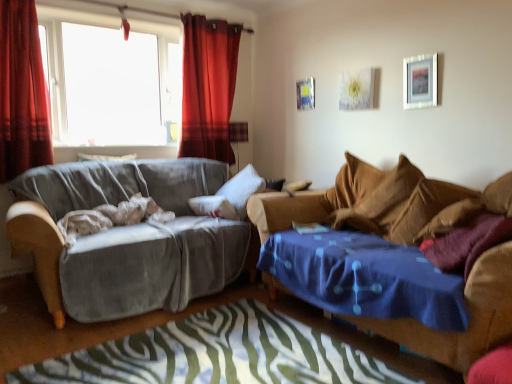
Question: In terms of height, does metallic silver picture frame at upper center, which is the second picture frame in front-to-back order, look taller or shorter compared to velvet gray couch at left, marked as the second studio couch in a right-to-left arrangement?

Choices:
 (A) tall
 (B) short

Answer: (B)

Question: From a real-world perspective, is metallic silver picture frame at upper center, placed as the 1th picture frame when sorted from left to right, positioned above or below velvet gray couch at left, marked as the second studio couch in a right-to-left arrangement?

Choices:
 (A) above
 (B) below

Answer: (A)

Question: Which of these objects is positioned closest to the brown fabric pillow at right?

Choices:
 (A) velvet red curtain at left, the first curtain from the front
 (B) metallic silver picture frame at upper center, which is the second picture frame in front-to-back order
 (C) silver metallic picture frame at upper right, the first picture frame from the front
 (D) velvet brown couch at right, which appears as the first studio couch when viewed from the right
 (E) velvet red curtain at upper left, the 1th curtain when ordered from right to left

Answer: (D)

Question: Which is farther from the velvet brown couch at right, which appears as the first studio couch when viewed from the right?

Choices:
 (A) velvet red curtain at upper left, the 2th curtain from the left
 (B) brown fabric pillow at right
 (C) velvet gray couch at left, marked as the 1th studio couch in a left-to-right arrangement
 (D) silver metallic picture frame at upper right, which is counted as the 2th picture frame, starting from the back
 (E) velvet red curtain at left, positioned as the second curtain in right-to-left order

Answer: (E)